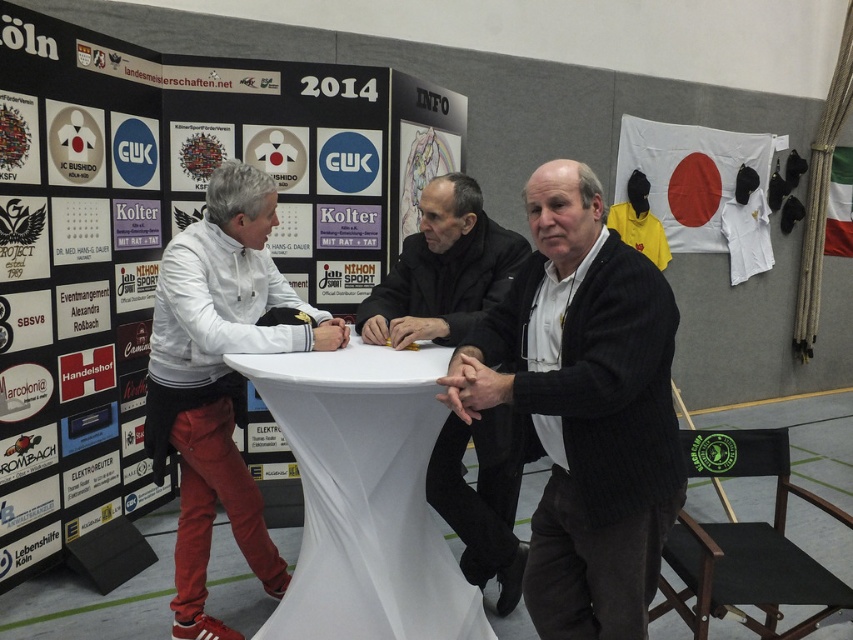
You are attending a formal event and notice two individuals. One is wearing a black woolen sweater at center and the other a white matte jacket at left. Which individual is positioned more to the right side of the scene?

The black woolen sweater at center is positioned to the right of the white matte jacket at left, so the individual in the black woolen sweater at center is more to the right side of the scene.